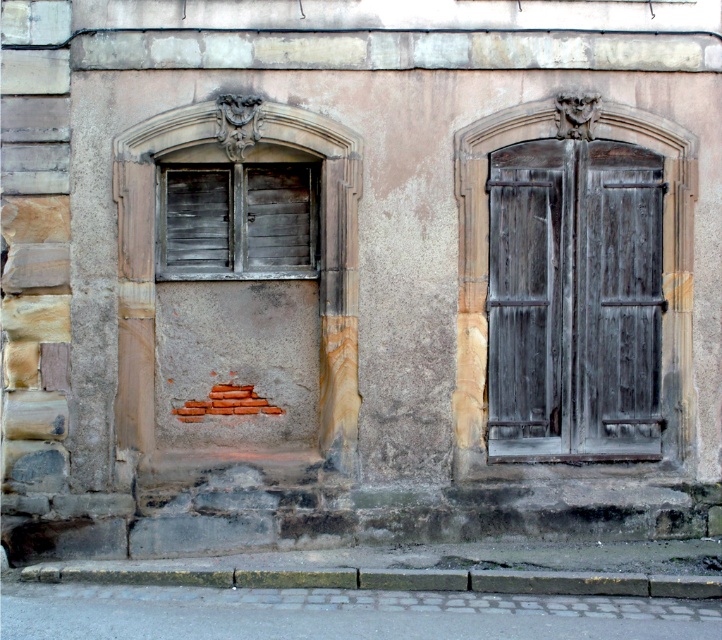
Question: Which object is closer to the camera taking this photo?

Choices:
 (A) dark gray wood shutters at center
 (B) wooden shutters at left
 (C) gray concrete curb at lower center

Answer: (C)

Question: Can you confirm if dark gray wood shutters at center is smaller than gray concrete curb at lower center?

Choices:
 (A) no
 (B) yes

Answer: (A)

Question: Which point is closer to the camera?

Choices:
 (A) wooden shutters at left
 (B) gray concrete curb at lower center
 (C) dark gray wood shutters at center

Answer: (B)

Question: Is wooden shutters at left positioned behind gray concrete curb at lower center?

Choices:
 (A) no
 (B) yes

Answer: (B)

Question: Does dark gray wood shutters at center appear on the right side of gray concrete curb at lower center?

Choices:
 (A) no
 (B) yes

Answer: (B)

Question: Which point is closer to the camera?

Choices:
 (A) gray concrete curb at lower center
 (B) dark gray wood shutters at center
 (C) wooden shutters at left

Answer: (A)